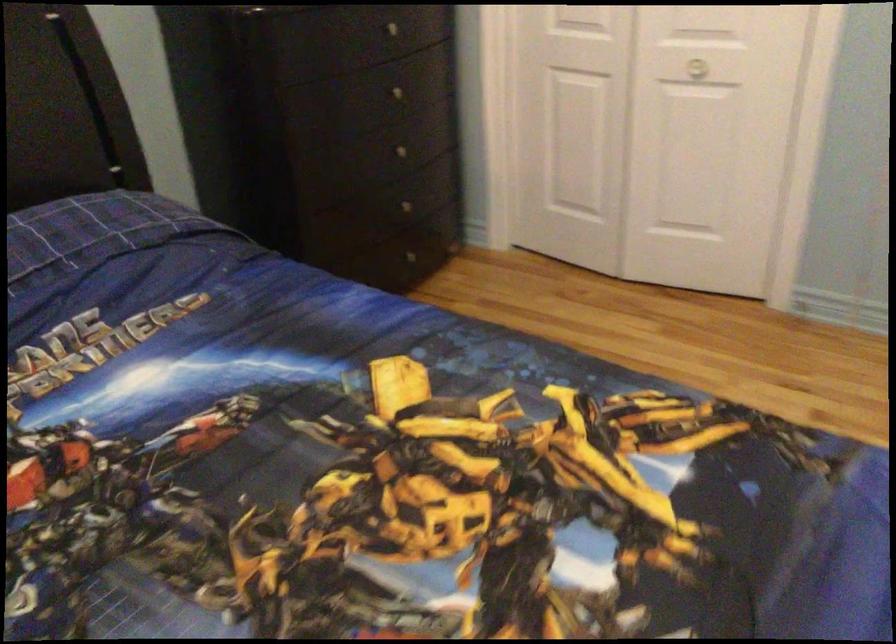
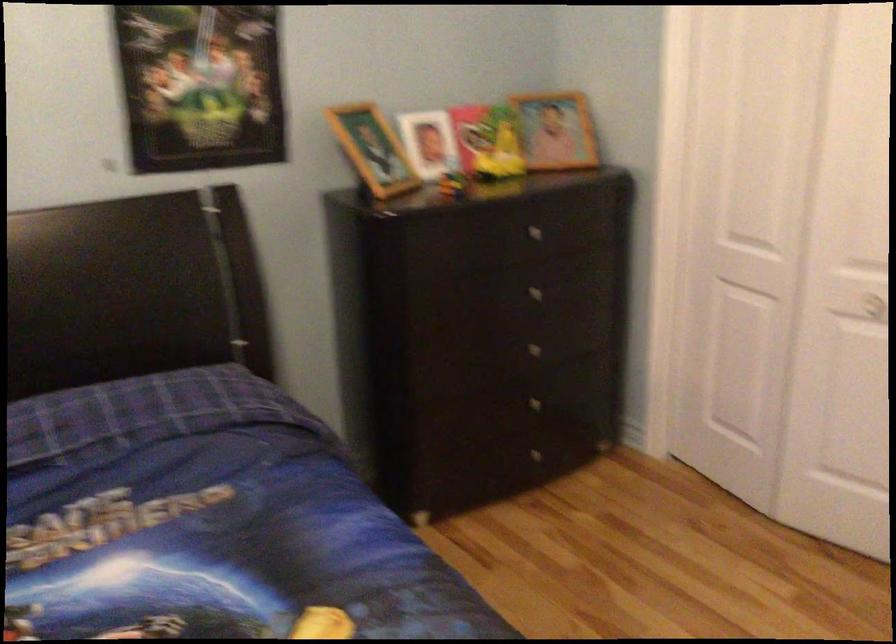
In the second image, find the point that corresponds to pixel 684 70 in the first image.

(864, 305)